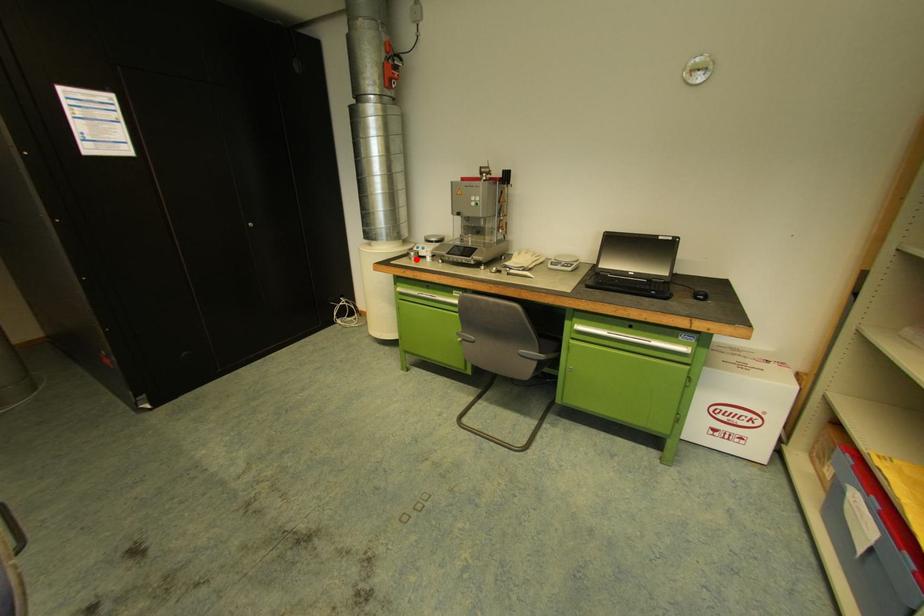
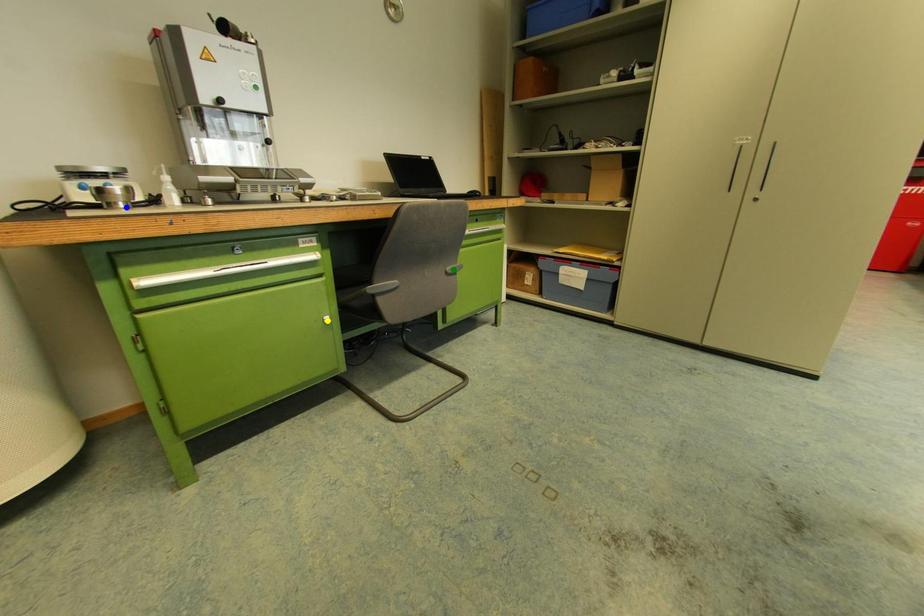
Question: I am providing you with two images of the same scene from different viewpoints. A red point is marked on the first image. You are given multiple points on the second image. Which point in image 2 represents the same 3d spot as the red point in image 1?

Choices:
 (A) blue point
 (B) yellow point
 (C) green point

Answer: (A)